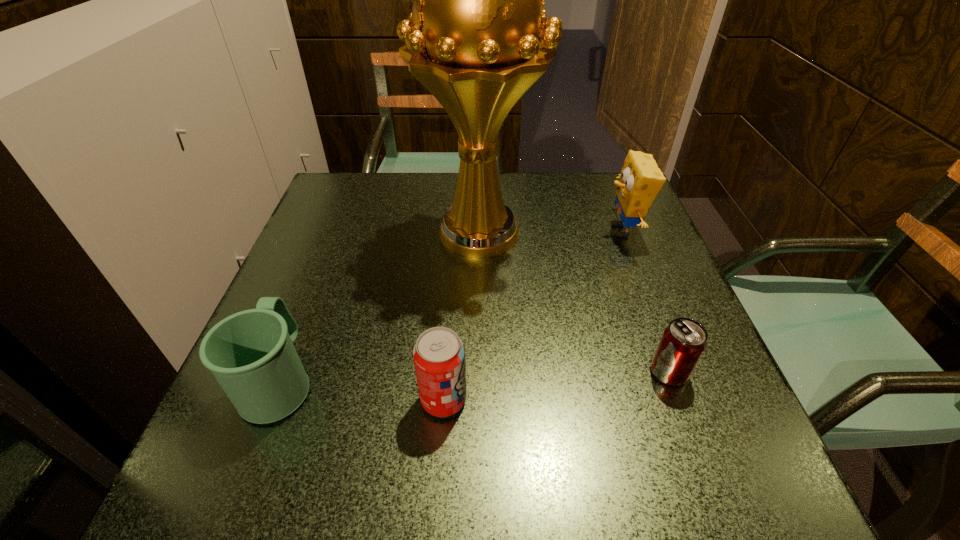
Identify the location of empty space between the taller pop soda and the shortest object. The image size is (960, 540). (557, 386).

The height and width of the screenshot is (540, 960). I want to click on vacant area that lies between the sponge and the mug, so click(x=451, y=305).

At what (x,y) coordinates should I click in order to perform the action: click on vacant area that lies between the leftmost object and the right pop soda. Please return your answer as a coordinate pair (x, y). The width and height of the screenshot is (960, 540). Looking at the image, I should click on (474, 376).

You are a GUI agent. You are given a task and a screenshot of the screen. Output one action in this format:
    pyautogui.click(x=<x>, y=<y>)
    Task: Click on the vacant area that lies between the trophy_cup and the fourth shortest object
    The width and height of the screenshot is (960, 540).
    Given the screenshot: What is the action you would take?
    tap(551, 233)

This screenshot has height=540, width=960. Find the location of `unoccupied area between the trophy_cup and the taller pop soda`. unoccupied area between the trophy_cup and the taller pop soda is located at coordinates (462, 318).

Locate an element on the screen. unoccupied area between the tallest object and the right pop soda is located at coordinates (574, 303).

Identify the location of vacant point located between the right pop soda and the trophy_cup. (574, 303).

The image size is (960, 540). What are the coordinates of `object identified as the third closest to the sponge` in the screenshot? It's located at (439, 354).

Where is `object that can be found as the third closest to the left pop soda`? This screenshot has width=960, height=540. object that can be found as the third closest to the left pop soda is located at coordinates (683, 342).

This screenshot has width=960, height=540. What are the coordinates of `free spot that satisfies the following two spatial constraints: 1. on the back side of the shortest object; 2. on the left side of the taller pop soda` in the screenshot? It's located at (445, 372).